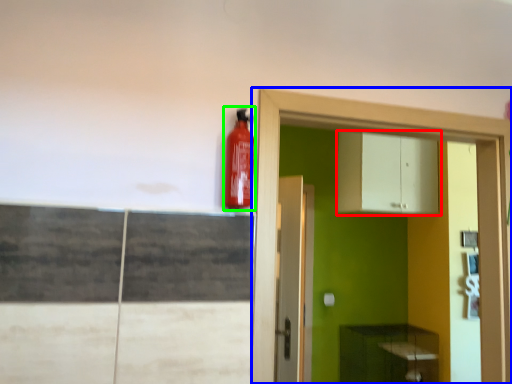
Question: Which object is positioned closest to cabinetry (highlighted by a red box)? Select from dresser (highlighted by a blue box) and extinguisher (highlighted by a green box).

Choices:
 (A) dresser
 (B) extinguisher

Answer: (A)